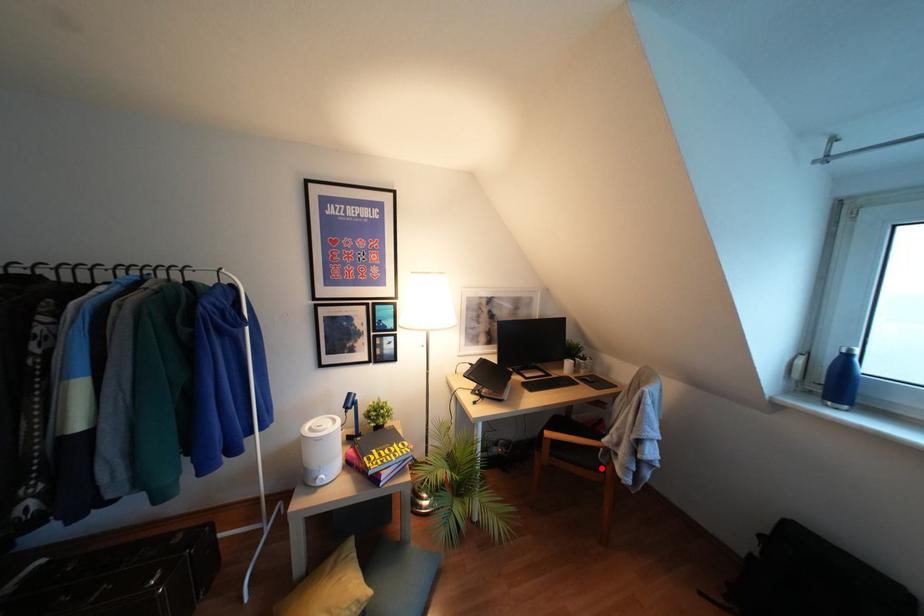
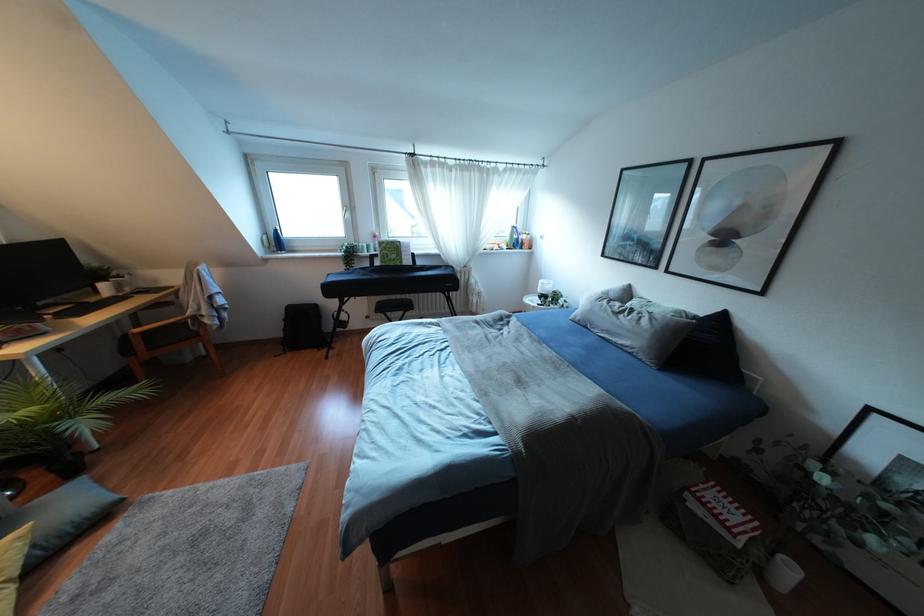
Question: I am providing you with two images of the same scene from different viewpoints. A red point is shown in image1. For the corresponding object point in image2, is it positioned nearer or farther from the camera?

Choices:
 (A) Nearer
 (B) Farther

Answer: (A)